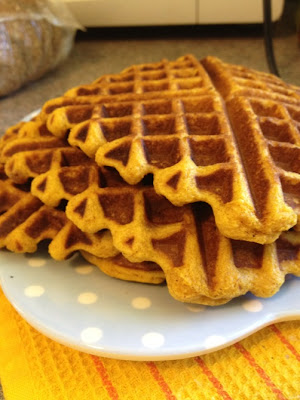
Locate an element on the screen. The height and width of the screenshot is (400, 300). orange towel is located at coordinates (69, 388), (267, 353).